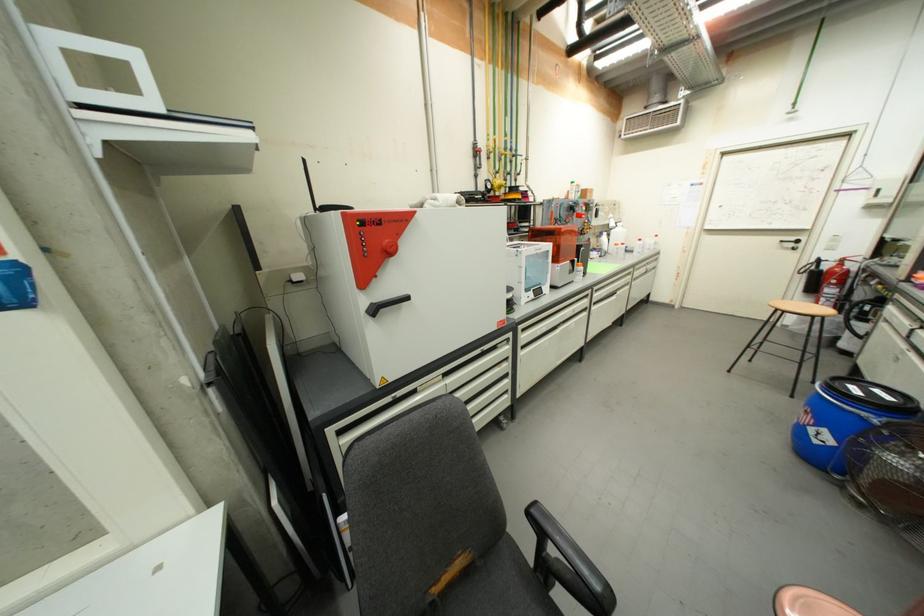
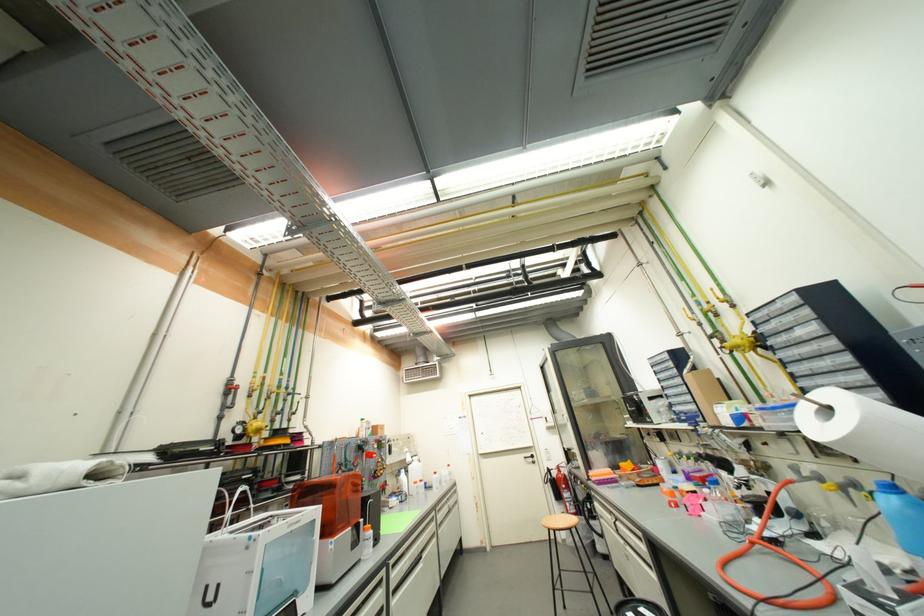
Question: I am providing you with two images of the same scene from different viewpoints. Which of the following objects are not visible in image2?

Choices:
 (A) white cabinet handle
 (B) black door handle
 (C) white paper towel
 (D) none of these

Answer: (D)